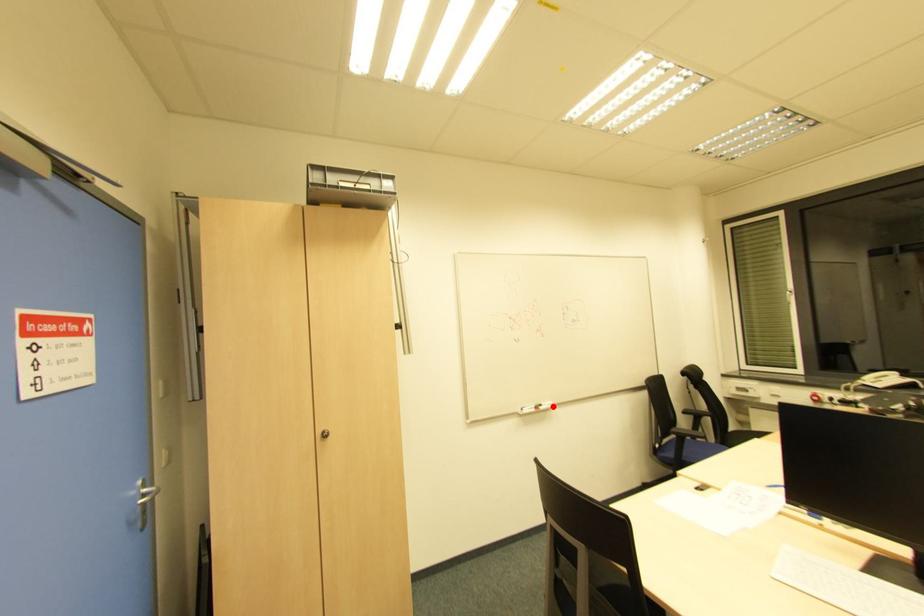
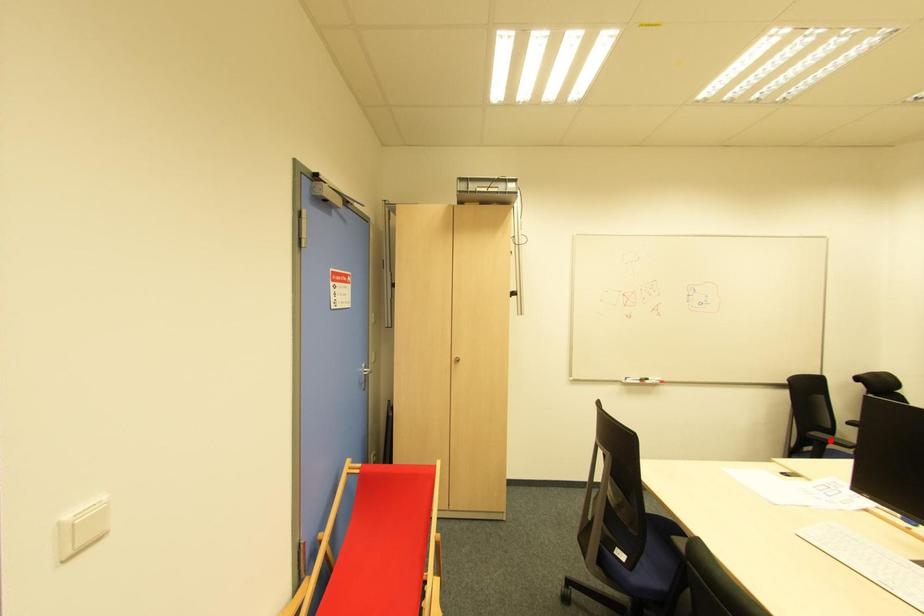
I am providing you with two images of the same scene from different viewpoints. A red point is marked on the first image and another point is marked on the second image. Is the red point in image1 aligned with the point shown in image2?

No